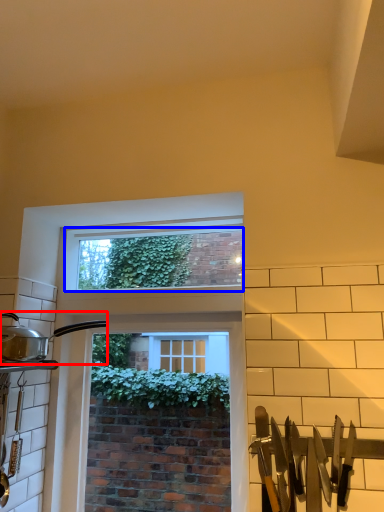
Question: Which of the following is the closest to the observer, kitchen appliance (highlighted by a red box) or window screen (highlighted by a blue box)?

Choices:
 (A) kitchen appliance
 (B) window screen

Answer: (A)